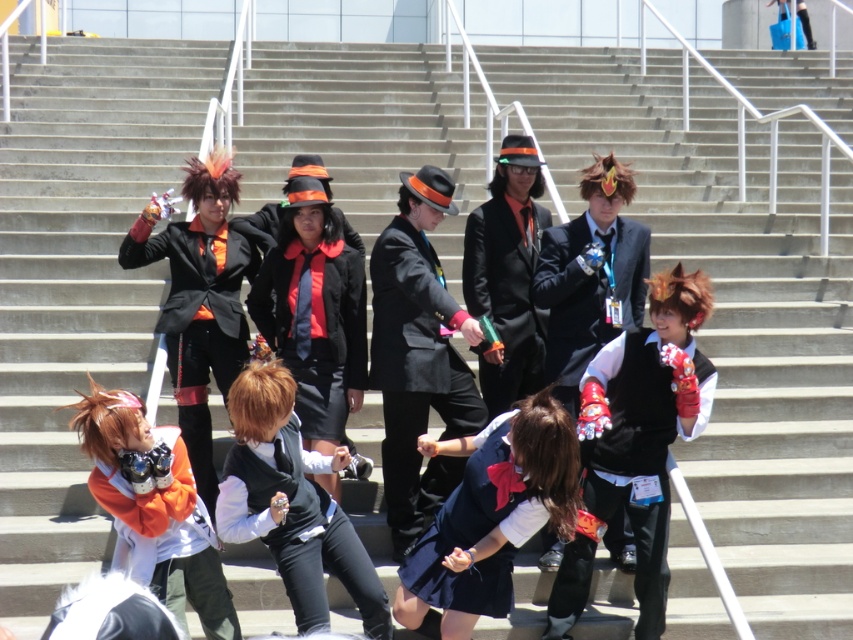
Question: Does white matte vest at center have a larger size compared to black matte suit at center?

Choices:
 (A) no
 (B) yes

Answer: (A)

Question: Considering the real-world distances, which object is farthest from the matte black vest at center?

Choices:
 (A) white matte vest at center
 (B) matte black jacket at center
 (C) velvet black vest at center

Answer: (C)

Question: Which object is positioned closest to the shiny black suit at center?

Choices:
 (A) matte black vest at center
 (B) matte orange vest at center
 (C) matte black jacket at center

Answer: (C)

Question: Is matte black vest at center to the right of shiny black suit at center from the viewer's perspective?

Choices:
 (A) no
 (B) yes

Answer: (A)

Question: Does matte orange vest at center appear on the left side of shiny black suit at center?

Choices:
 (A) yes
 (B) no

Answer: (A)

Question: Which object is closer to the camera taking this photo?

Choices:
 (A) shiny black suit at center
 (B) black matte suit at center

Answer: (B)